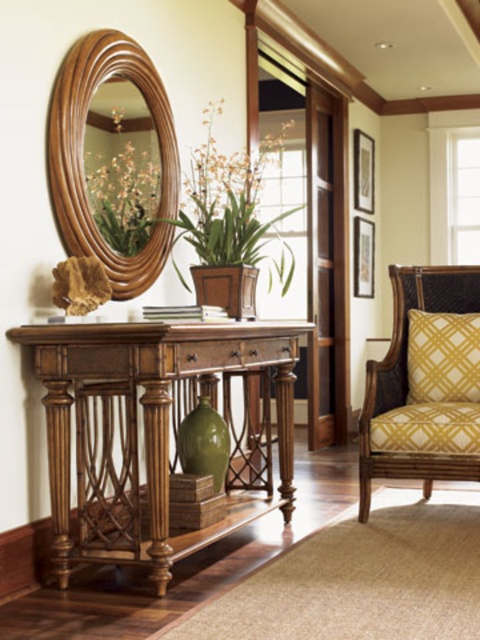
Which is in front, point (109, 472) or point (404, 436)?

Point (109, 472) is more forward.

Does mahogany wood console table at center appear on the left side of yellow fabric armchair at right?

Indeed, mahogany wood console table at center is positioned on the left side of yellow fabric armchair at right.

Is point (84, 428) in front of point (454, 381)?

That is True.

What are the coordinates of `mahogany wood console table at center` in the screenshot? It's located at (153, 433).

Does point (143, 349) come farther from viewer compared to point (96, 65)?

No, it is not.

Is mahogany wood console table at center further to camera compared to wooden oval mirror at upper left?

No, mahogany wood console table at center is closer to the viewer.

Who is more distant from viewer, (109, 531) or (66, 186)?

The point (66, 186) is behind.

Locate an element on the screen. This screenshot has width=480, height=640. mahogany wood console table at center is located at coordinates (153, 433).

Who is positioned more to the left, yellow fabric armchair at right or green matte vase at center?

green matte vase at center

Is yellow fabric armchair at right closer to camera compared to green matte vase at center?

No, it is behind green matte vase at center.

This screenshot has width=480, height=640. Describe the element at coordinates (424, 384) in the screenshot. I see `yellow fabric armchair at right` at that location.

Identify the location of yellow fabric armchair at right. (424, 384).